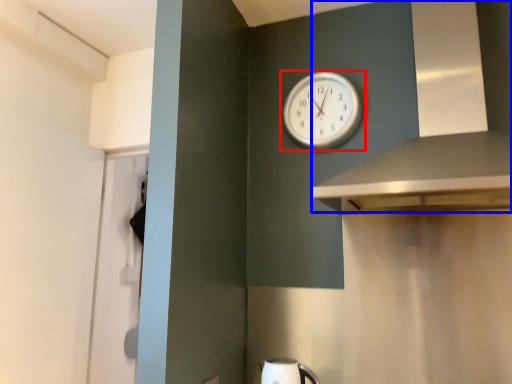
Question: Which point is closer to the camera, wall clock (highlighted by a red box) or vent (highlighted by a blue box)?

Choices:
 (A) wall clock
 (B) vent

Answer: (B)